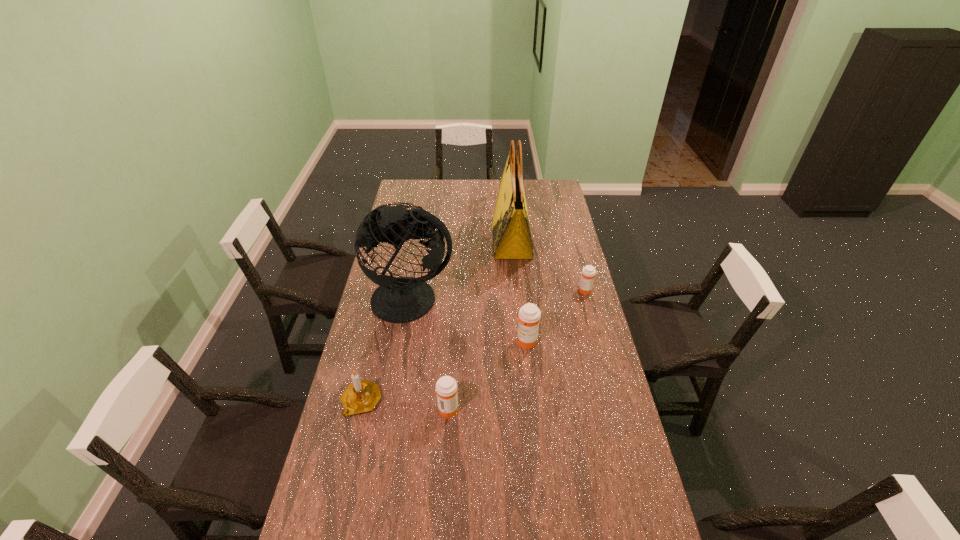
Identify the location of free point at the far edge. (452, 199).

Identify the location of free space at the near edge. (519, 524).

The height and width of the screenshot is (540, 960). Find the location of `free space at the left edge of the desktop`. free space at the left edge of the desktop is located at coordinates (338, 451).

At what (x,y) coordinates should I click in order to perform the action: click on blank space at the right edge of the desktop. Please return your answer as a coordinate pair (x, y). Looking at the image, I should click on (577, 249).

Locate an element on the screen. This screenshot has width=960, height=540. free area in between the globe and the shortest medicine is located at coordinates (499, 295).

At what (x,y) coordinates should I click in order to perform the action: click on free space that is in between the third nearest object and the rightmost object. Please return your answer as a coordinate pair (x, y). The height and width of the screenshot is (540, 960). Looking at the image, I should click on (556, 316).

The width and height of the screenshot is (960, 540). I want to click on free spot between the second tallest medicine and the tote bag, so click(480, 325).

This screenshot has width=960, height=540. I want to click on vacant space that is in between the globe and the leftmost medicine, so click(430, 354).

Where is `vacant point located between the leftmost medicine and the globe`? The image size is (960, 540). vacant point located between the leftmost medicine and the globe is located at coordinates (430, 354).

I want to click on vacant point located between the globe and the second medicine from left to right, so click(468, 321).